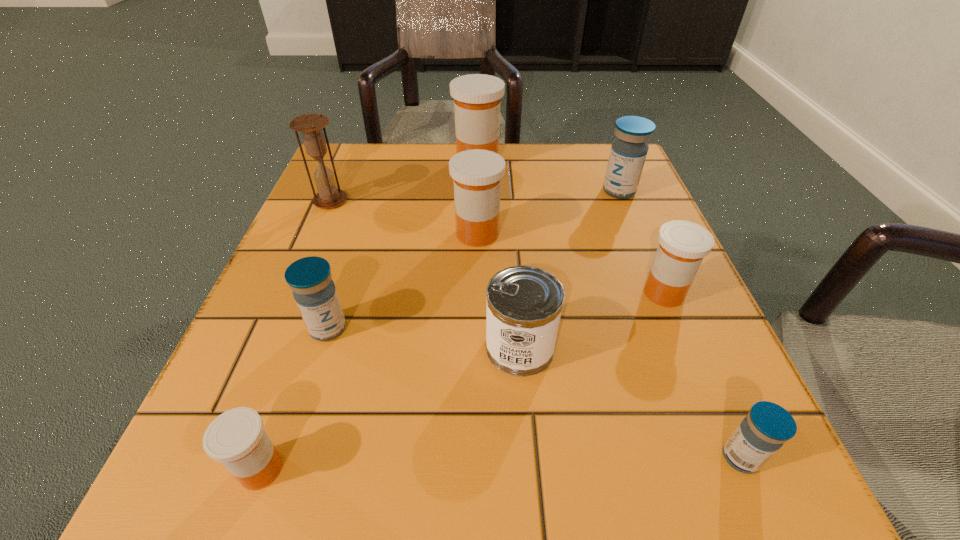
The width and height of the screenshot is (960, 540). I want to click on medicine object that ranks as the second closest to the fifth farthest medicine, so click(x=476, y=173).

Locate which medicine is the fifth closest to the third smallest orange medicine. Please provide its 2D coordinates. Your answer should be formatted as a tuple, i.e. [(x, y)], where the tuple contains the x and y coordinates of a point satisfying the conditions above.

[(236, 438)]

At what (x,y) coordinates should I click in order to perform the action: click on orange medicine identified as the third closest to the fifth farthest object. Please return your answer as a coordinate pair (x, y). This screenshot has width=960, height=540. Looking at the image, I should click on (236, 438).

This screenshot has height=540, width=960. In order to click on orange medicine that stands as the closest to the nearest blue medicine in this screenshot , I will do `click(682, 246)`.

Identify which blue medicine is the third nearest to the can. Please provide its 2D coordinates. Your answer should be formatted as a tuple, i.e. [(x, y)], where the tuple contains the x and y coordinates of a point satisfying the conditions above.

[(628, 152)]

In order to click on blue medicine that is the closest to the third nearest medicine in this screenshot , I will do pyautogui.click(x=765, y=429).

You are a GUI agent. You are given a task and a screenshot of the screen. Output one action in this format:
    pyautogui.click(x=<x>, y=<y>)
    Task: Click on the free spot that satisfies the following two spatial constraints: 1. on the back side of the hourglass; 2. on the left side of the farthest blue medicine
    The width and height of the screenshot is (960, 540).
    Given the screenshot: What is the action you would take?
    pyautogui.click(x=334, y=191)

The height and width of the screenshot is (540, 960). What are the coordinates of `vacant space that satisfies the following two spatial constraints: 1. on the front side of the can; 2. on the label of the nearest orange medicine` in the screenshot? It's located at (530, 469).

Identify the location of blank area in the image that satisfies the following two spatial constraints: 1. on the back side of the second farthest medicine; 2. on the left side of the can. (508, 191).

Locate an element on the screen. This screenshot has height=540, width=960. vacant area in the image that satisfies the following two spatial constraints: 1. on the front side of the nearest blue medicine; 2. on the left side of the can is located at coordinates (529, 457).